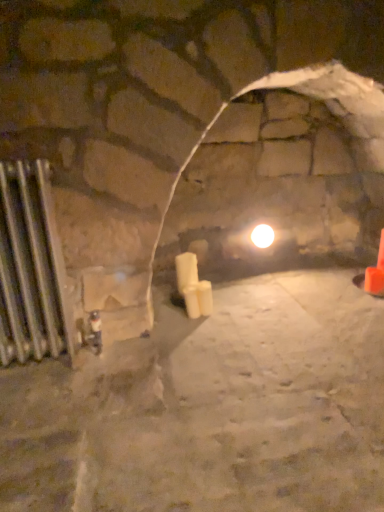
This screenshot has width=384, height=512. Describe the element at coordinates (186, 270) in the screenshot. I see `white matte candle at center` at that location.

What is the approximate width of orange plastic traffic cone at right?

The width of orange plastic traffic cone at right is 4.89 inches.

Where is `silver metallic radiator at left`? The image size is (384, 512). silver metallic radiator at left is located at coordinates pos(31,267).

Where is `white glossy light bulb at center`? This screenshot has width=384, height=512. white glossy light bulb at center is located at coordinates (262, 236).

Is point (182, 268) behind point (380, 246)?

No, it is not.

Is the depth of white matte candle at center less than that of orange plastic traffic cone at right?

Yes, the depth of white matte candle at center is less than that of orange plastic traffic cone at right.

Is white matte candle at center positioned with its back to orange plastic traffic cone at right?

That's not correct — white matte candle at center is not looking away from orange plastic traffic cone at right.

From the image's perspective, which one is positioned higher, white matte candle at center or orange plastic traffic cone at right?

From the image's view, orange plastic traffic cone at right is above.

From the image's perspective, is white glossy light bulb at center above white matte candle at center?

Yes, from the image's perspective, white glossy light bulb at center is above white matte candle at center.

Does point (257, 228) appear closer or farther from the camera than point (187, 276)?

Point (257, 228) is positioned farther from the camera compared to point (187, 276).

From a real-world perspective, relative to white matte candle at center, is white glossy light bulb at center vertically above or below?

white glossy light bulb at center is above white matte candle at center.

Can you confirm if white matte candle at center is positioned to the right of white glossy light bulb at center?

In fact, white matte candle at center is to the left of white glossy light bulb at center.

Is the depth of white matte candle at center less than that of white glossy light bulb at center?

Yes, it is in front of white glossy light bulb at center.

In the scene shown: Is white glossy light bulb at center located within white matte candle at center?

No, white glossy light bulb at center is not surrounded by white matte candle at center.

From a real-world perspective, which object rests below the other?

white matte candle at center, from a real-world perspective.

Is orange plastic traffic cone at right closer to the viewer compared to white matte candle at center?

That is False.

Is point (373, 290) in front of point (192, 272)?

Yes, it is.

Does point (373, 275) lie in front of point (258, 225)?

That is True.

Is orange plastic traffic cone at right far away from white glossy light bulb at center?

orange plastic traffic cone at right is actually quite close to white glossy light bulb at center.

Where is `light that appears above the orange plastic traffic cone at right (from the image's perspective)`? The image size is (384, 512). light that appears above the orange plastic traffic cone at right (from the image's perspective) is located at coordinates (262, 236).

From a real-world perspective, is orange plastic traffic cone at right under white glossy light bulb at center?

Yes.

Could white matte candle at center be considered to be inside silver metallic radiator at left?

Definitely not — white matte candle at center is not inside silver metallic radiator at left.

Is point (2, 251) closer or farther from the camera than point (189, 263)?

Point (2, 251) is closer to the camera than point (189, 263).

Which object is closer to the camera taking this photo, silver metallic radiator at left or white matte candle at center?

silver metallic radiator at left is more forward.

Which is more to the right, orange plastic traffic cone at right or silver metallic radiator at left?

Positioned to the right is orange plastic traffic cone at right.

Looking at this image, does orange plastic traffic cone at right contain silver metallic radiator at left?

No.

Does orange plastic traffic cone at right lie behind silver metallic radiator at left?

Yes.

Does point (377, 279) come closer to viewer compared to point (38, 225)?

No, it is behind (38, 225).

Where is `traffic cone above the white matte candle at center (from a real-world perspective)`? traffic cone above the white matte candle at center (from a real-world perspective) is located at coordinates (376, 273).

The image size is (384, 512). What are the coordinates of `light that appears on the right of white matte candle at center` in the screenshot? It's located at (262, 236).

Which object lies nearer to the anchor point white matte candle at center, white glossy light bulb at center or silver metallic radiator at left?

white glossy light bulb at center is closer to white matte candle at center.

From the image, which object appears to be farther from white glossy light bulb at center, silver metallic radiator at left or white matte candle at center?

silver metallic radiator at left is positioned further to the anchor white glossy light bulb at center.

Considering their positions, is white glossy light bulb at center positioned further to orange plastic traffic cone at right than white matte candle at center?

white matte candle at center is further to orange plastic traffic cone at right.

Looking at the image, which one is located further to orange plastic traffic cone at right, white glossy light bulb at center or silver metallic radiator at left?

Based on the image, silver metallic radiator at left appears to be further to orange plastic traffic cone at right.

Considering their positions, is orange plastic traffic cone at right positioned further to white glossy light bulb at center than white matte candle at center?

Among the two, orange plastic traffic cone at right is located further to white glossy light bulb at center.

Estimate the real-world distances between objects in this image. Which object is further from white matte candle at center, orange plastic traffic cone at right or silver metallic radiator at left?

orange plastic traffic cone at right is further to white matte candle at center.

Which object lies further to the anchor point silver metallic radiator at left, white matte candle at center or orange plastic traffic cone at right?

orange plastic traffic cone at right is further to silver metallic radiator at left.

Which object lies further to the anchor point white glossy light bulb at center, orange plastic traffic cone at right or silver metallic radiator at left?

silver metallic radiator at left is further to white glossy light bulb at center.

Find the location of a particular element. The width and height of the screenshot is (384, 512). light between white matte candle at center and orange plastic traffic cone at right is located at coordinates (262, 236).

Identify the location of candle positioned between silver metallic radiator at left and white glossy light bulb at center from near to far. (186, 270).

At what (x,y) coordinates should I click in order to perform the action: click on candle between silver metallic radiator at left and orange plastic traffic cone at right in the horizontal direction. Please return your answer as a coordinate pair (x, y). Image resolution: width=384 pixels, height=512 pixels. Looking at the image, I should click on (186, 270).

Find the location of a particular element. This screenshot has height=512, width=384. light between silver metallic radiator at left and orange plastic traffic cone at right from left to right is located at coordinates (262, 236).